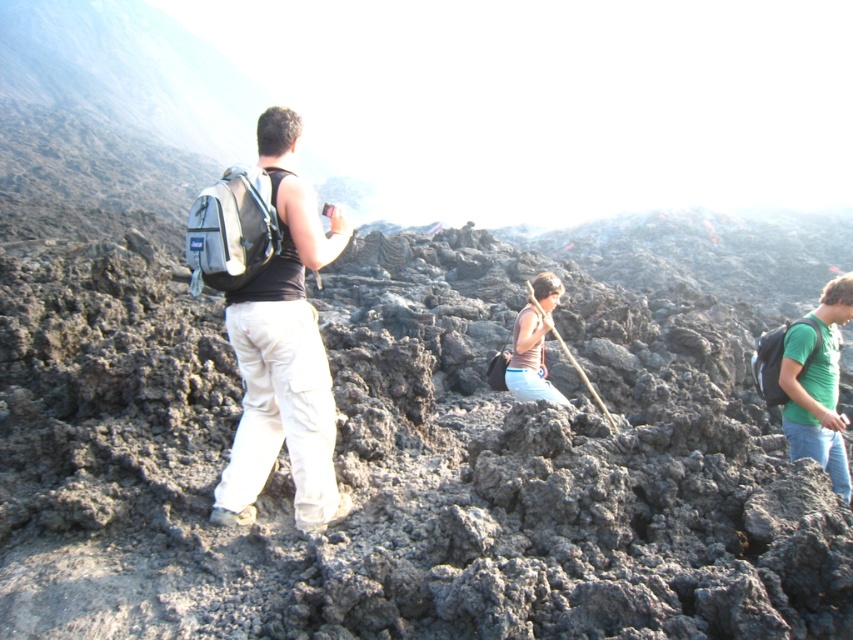
Question: Is matte black backpack at center to the right of matte brown shirt at center from the viewer's perspective?

Choices:
 (A) yes
 (B) no

Answer: (B)

Question: Does green matte shirt at right have a smaller size compared to matte brown shirt at center?

Choices:
 (A) no
 (B) yes

Answer: (A)

Question: Does green matte shirt at right appear under matte brown shirt at center?

Choices:
 (A) no
 (B) yes

Answer: (B)

Question: Based on their relative distances, which object is farther from the matte black backpack at center?

Choices:
 (A) green matte shirt at right
 (B) matte brown shirt at center

Answer: (A)

Question: Which of the following is the farthest from the observer?

Choices:
 (A) (257, 298)
 (B) (833, 460)

Answer: (B)

Question: Among these objects, which one is farthest from the camera?

Choices:
 (A) matte brown shirt at center
 (B) matte black backpack at center
 (C) green matte shirt at right

Answer: (A)